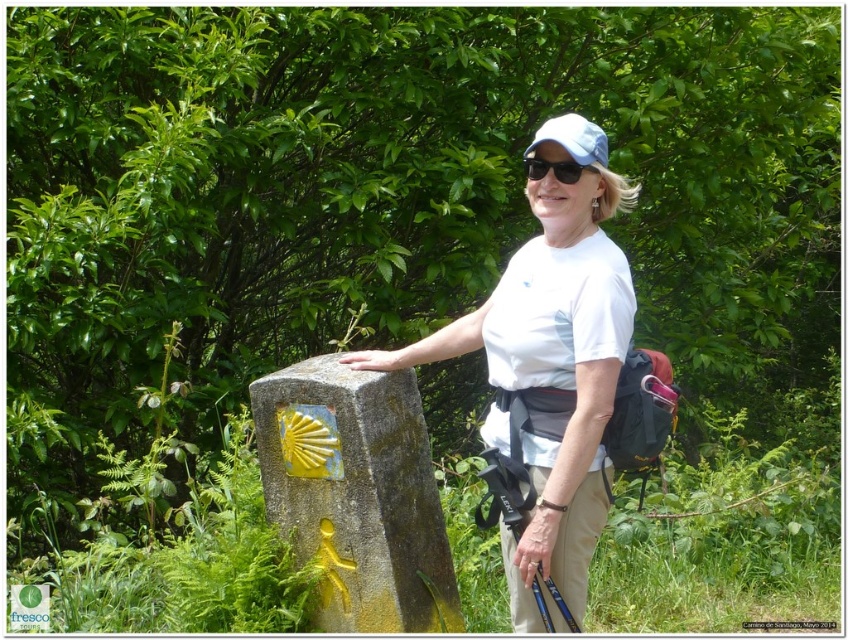
Does white cotton shirt at center have a greater width compared to black matte sunglasses at center?

Indeed, white cotton shirt at center has a greater width compared to black matte sunglasses at center.

In the scene shown: Who is more forward, (601, 317) or (530, 177)?

Positioned in front is point (601, 317).

The image size is (848, 640). What do you see at coordinates (551, 372) in the screenshot? I see `white cotton shirt at center` at bounding box center [551, 372].

Image resolution: width=848 pixels, height=640 pixels. In order to click on white cotton shirt at center in this screenshot , I will do `click(551, 372)`.

Is point (603, 147) positioned before point (533, 157)?

Yes, it is in front of point (533, 157).

Which is behind, point (530, 157) or point (538, 177)?

Positioned behind is point (530, 157).

Find the location of a particular element. This screenshot has width=848, height=640. light blue fabric baseball cap at center is located at coordinates (573, 140).

Is white cotton shirt at center to the left of light blue fabric baseball cap at center from the viewer's perspective?

Yes, white cotton shirt at center is to the left of light blue fabric baseball cap at center.

Does white cotton shirt at center appear on the right side of light blue fabric baseball cap at center?

No, white cotton shirt at center is not to the right of light blue fabric baseball cap at center.

Find the location of `white cotton shirt at center`. white cotton shirt at center is located at coordinates (551, 372).